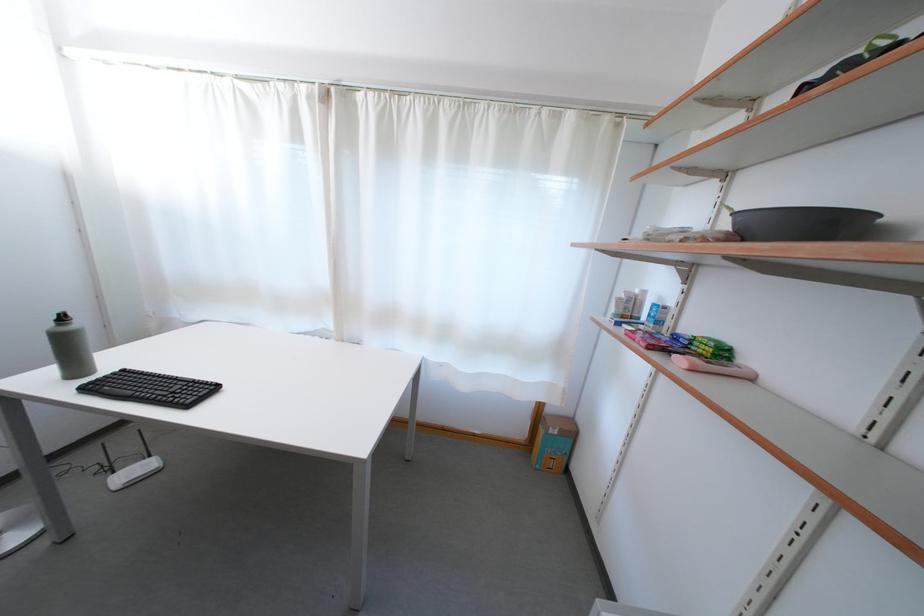
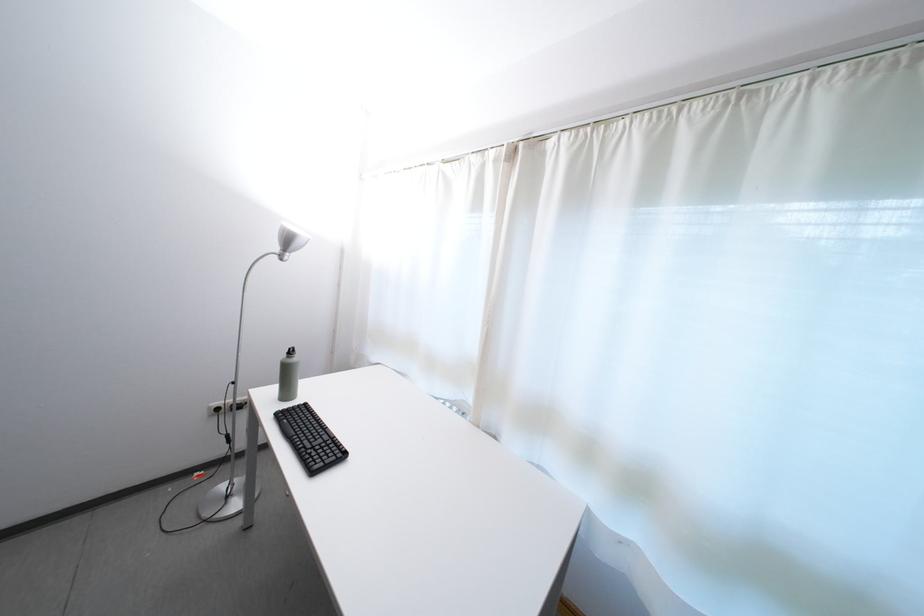
Question: The images are taken continuously from a first-person perspective. In which direction is your viewpoint rotating?

Choices:
 (A) Left
 (B) Right
 (C) Up
 (D) Down

Answer: (A)